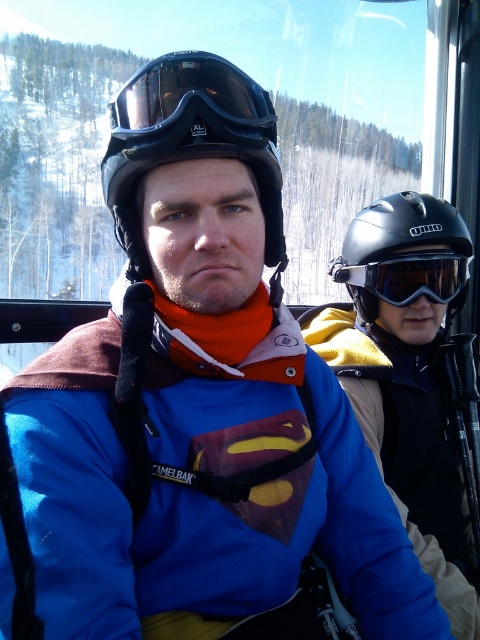
You are a photographer trying to capture a closeup of the matte black helmet at center and the black matte goggles at center in the ski lift cabin. Which object should you focus on first if you want to capture both in a single frame without moving the camera?

The matte black helmet at center is positioned on the left side of black matte goggles at center, so you should focus on the matte black helmet at center first to ensure both objects are in frame without moving the camera.

You are planning to pack your gear for a ski trip and have a small backpack. You need to decide whether the black matte helmet at right and the black matte goggles at center can fit together. Based on their sizes, which one takes up more space?

The black matte helmet at right has a larger size compared to black matte goggles at center, so the black matte helmet at right takes up more space and may not fit with the goggles in the small backpack.